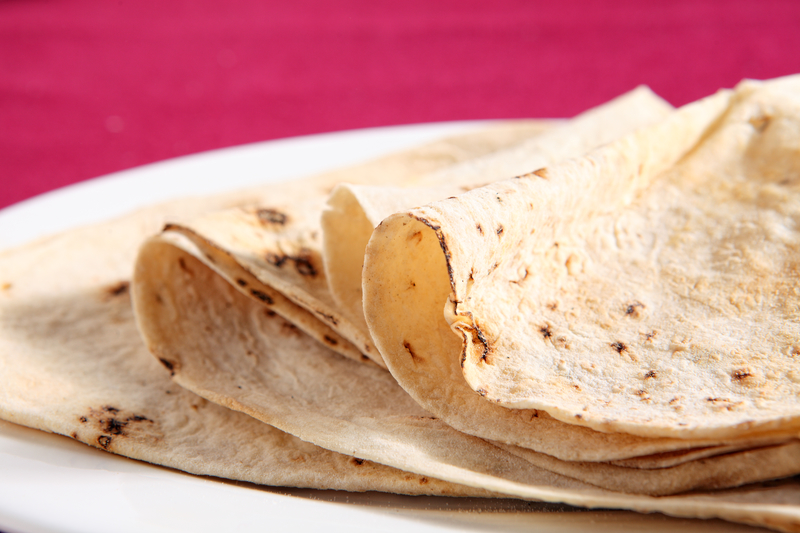
Where is `table`? table is located at coordinates (348, 87).